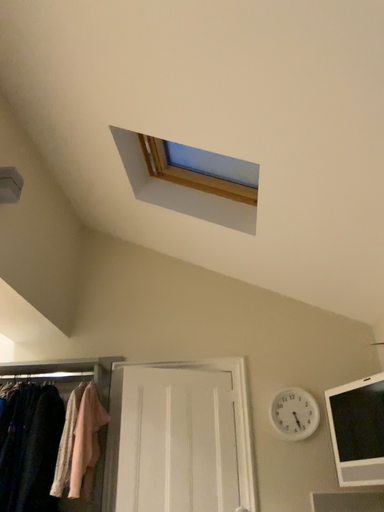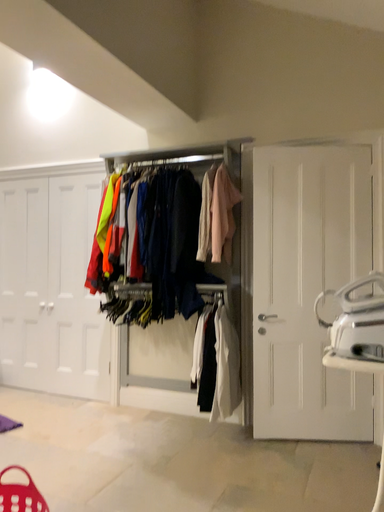
Question: How did the camera likely rotate when shooting the video?

Choices:
 (A) rotated downward
 (B) rotated upward

Answer: (A)